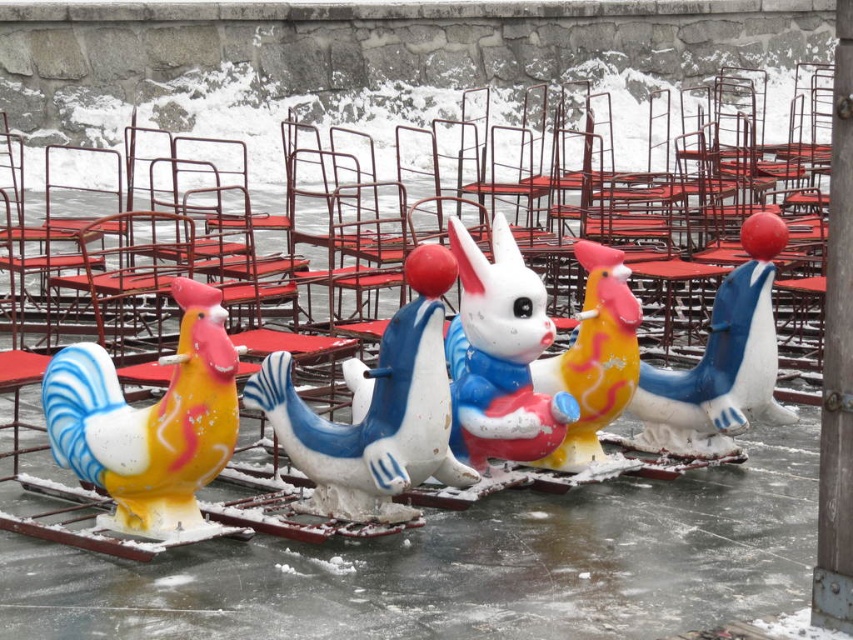
Is matte plastic chicken at left positioned behind matte plastic rabbit at center?

That is False.

Between point (193, 310) and point (543, 432), which one is positioned behind?

Positioned behind is point (543, 432).

Identify the location of matte plastic chicken at left. The height and width of the screenshot is (640, 853). (149, 422).

Is matte plastic rabbit at center to the right of yellow matte chicken at center from the viewer's perspective?

Incorrect, matte plastic rabbit at center is not on the right side of yellow matte chicken at center.

Can you confirm if matte plastic rabbit at center is bigger than yellow matte chicken at center?

Yes, matte plastic rabbit at center is bigger than yellow matte chicken at center.

Where is `matte plastic rabbit at center`? Image resolution: width=853 pixels, height=640 pixels. matte plastic rabbit at center is located at coordinates click(498, 355).

You are a GUI agent. You are given a task and a screenshot of the screen. Output one action in this format:
    pyautogui.click(x=<x>, y=<y>)
    Task: Click on the matte plastic rabbit at center
    
    Given the screenshot: What is the action you would take?
    pyautogui.click(x=498, y=355)

Between matte plastic duck at center and yellow matte chicken at center, which one is positioned higher?

Positioned higher is matte plastic duck at center.

Between matte plastic duck at center and yellow matte chicken at center, which one appears on the right side from the viewer's perspective?

matte plastic duck at center is more to the right.

Where is `matte plastic duck at center`? This screenshot has height=640, width=853. matte plastic duck at center is located at coordinates (720, 362).